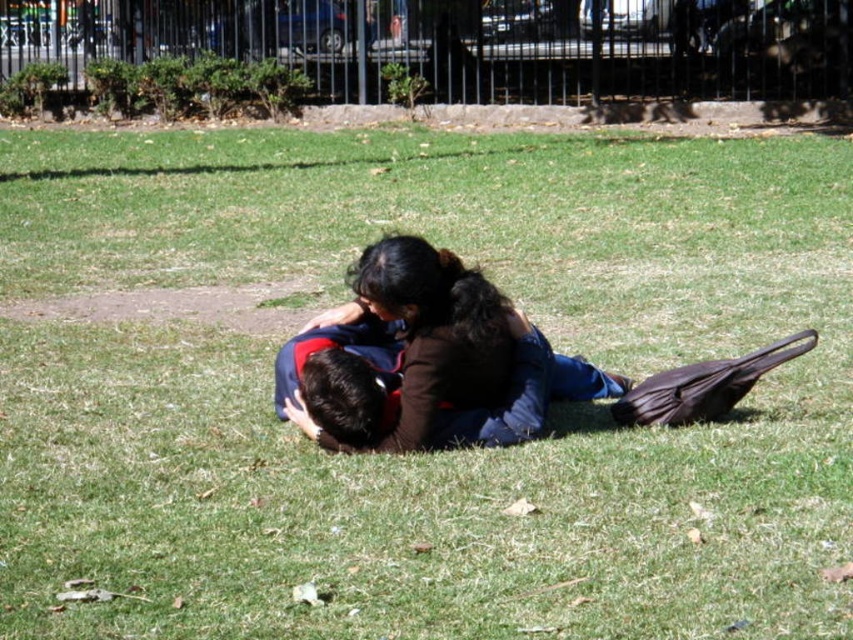
Who is lower down, matte blue shirt at center or dark blue fabric shirt at center?

dark blue fabric shirt at center is lower down.

Measure the distance between point (485, 310) and camera.

They are 6.07 meters apart.

You are a GUI agent. You are given a task and a screenshot of the screen. Output one action in this format:
    pyautogui.click(x=<x>, y=<y>)
    Task: Click on the matte blue shirt at center
    
    Given the screenshot: What is the action you would take?
    pyautogui.click(x=421, y=353)

Locate an element on the screen. The width and height of the screenshot is (853, 640). matte blue shirt at center is located at coordinates (421, 353).